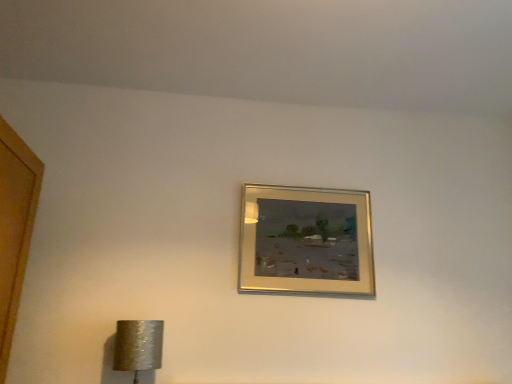
Question: Should I look upward or downward to see silver textured lampshade at lower left?

Choices:
 (A) up
 (B) down

Answer: (B)

Question: Considering the relative positions of silver textured lampshade at lower left and gold metallic picture frame at upper center in the image provided, is silver textured lampshade at lower left to the left of gold metallic picture frame at upper center from the viewer's perspective?

Choices:
 (A) no
 (B) yes

Answer: (B)

Question: Does silver textured lampshade at lower left have a smaller size compared to gold metallic picture frame at upper center?

Choices:
 (A) no
 (B) yes

Answer: (B)

Question: Is silver textured lampshade at lower left at the right side of gold metallic picture frame at upper center?

Choices:
 (A) no
 (B) yes

Answer: (A)

Question: Is silver textured lampshade at lower left oriented away from gold metallic picture frame at upper center?

Choices:
 (A) yes
 (B) no

Answer: (B)

Question: Could you tell me if silver textured lampshade at lower left is turned towards gold metallic picture frame at upper center?

Choices:
 (A) yes
 (B) no

Answer: (B)

Question: Can you confirm if silver textured lampshade at lower left is bigger than gold metallic picture frame at upper center?

Choices:
 (A) yes
 (B) no

Answer: (B)

Question: Considering the relative positions of gold metallic picture frame at upper center and silver textured lampshade at lower left in the image provided, is gold metallic picture frame at upper center in front of silver textured lampshade at lower left?

Choices:
 (A) yes
 (B) no

Answer: (B)

Question: Is gold metallic picture frame at upper center looking in the opposite direction of silver textured lampshade at lower left?

Choices:
 (A) yes
 (B) no

Answer: (B)

Question: Considering the relative positions of gold metallic picture frame at upper center and silver textured lampshade at lower left in the image provided, is gold metallic picture frame at upper center to the left of silver textured lampshade at lower left from the viewer's perspective?

Choices:
 (A) no
 (B) yes

Answer: (A)

Question: Does gold metallic picture frame at upper center have a lesser width compared to silver textured lampshade at lower left?

Choices:
 (A) no
 (B) yes

Answer: (B)

Question: Does gold metallic picture frame at upper center touch silver textured lampshade at lower left?

Choices:
 (A) no
 (B) yes

Answer: (A)

Question: Is gold metallic picture frame at upper center far away from silver textured lampshade at lower left?

Choices:
 (A) yes
 (B) no

Answer: (B)

Question: Is gold metallic picture frame at upper center to the left or to the right of silver textured lampshade at lower left in the image?

Choices:
 (A) left
 (B) right

Answer: (B)